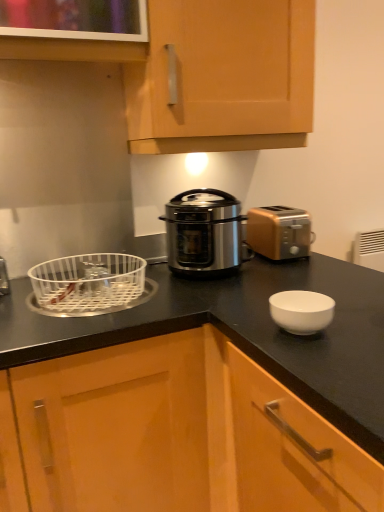
Identify the location of blank space situated above wooden cabinet at center, which ranks as the 2th cabinetry in top-to-bottom order (from a real-world perspective). This screenshot has width=384, height=512. (311, 286).